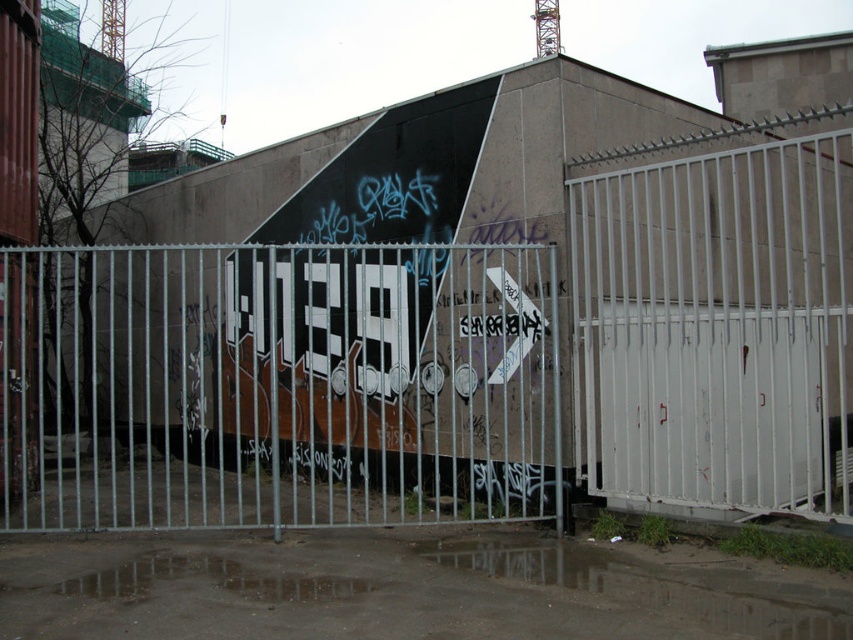
You are standing at the point closest to the viewer. Which point, point (395, 285) or point (718, 429), is farther away from you?

Point (395, 285) is behind point (718, 429), so it is farther away from you.

You are standing at point 0.5, 0.5 in the scene. Which direction should you move to reach the white metal fence at center?

The white metal fence at center is located at point [454,356], so you should move northeast to reach it from your current position at [426,320].

In the scene shown: You are standing in front of the white metal fence at center and want to walk to the white metal gate at right. Which direction should you move relative to the fence to reach the gate?

Since the white metal fence at center is closer to the viewer than the white metal gate at right, you should move towards the right side of the fence to reach the gate.